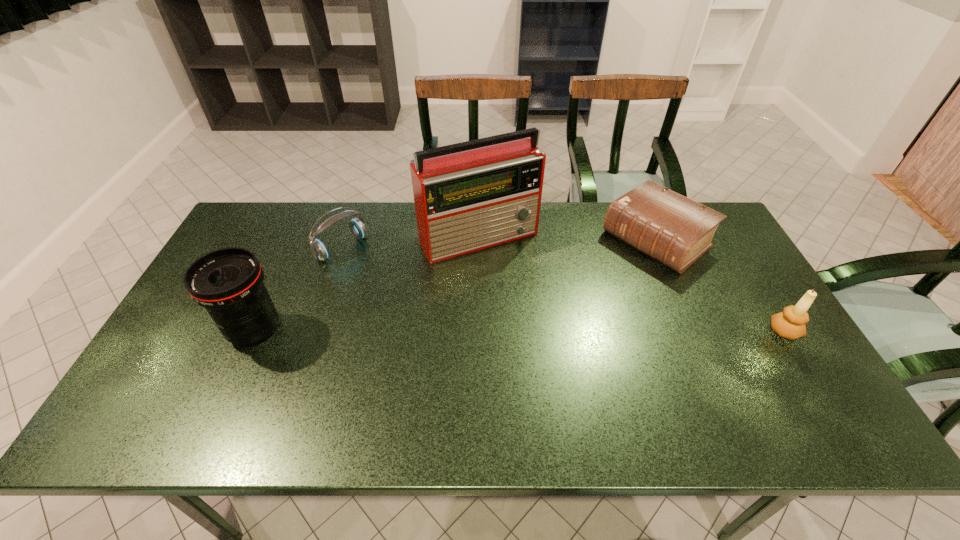
I want to click on vacant point located between the fourth object from left to right and the radio receiver, so click(x=567, y=238).

Locate an element on the screen. free space between the telephoto lens and the rightmost object is located at coordinates (519, 330).

Identify the location of vacant area that lies between the candle_holder and the headset. (563, 289).

Where is `vacant space in between the candle_holder and the radio receiver`? vacant space in between the candle_holder and the radio receiver is located at coordinates (632, 284).

Where is `vacant point located between the fourth shortest object and the rightmost object`? vacant point located between the fourth shortest object and the rightmost object is located at coordinates (519, 330).

Where is `vacant space that is in between the fourth object from left to right and the radio receiver`? vacant space that is in between the fourth object from left to right and the radio receiver is located at coordinates (567, 238).

What are the coordinates of `vacant area that lies between the tallest object and the fourth object from left to right` in the screenshot? It's located at (567, 238).

This screenshot has height=540, width=960. What are the coordinates of `vacant region between the Bible and the second tallest object` in the screenshot? It's located at (456, 285).

Locate an element on the screen. The width and height of the screenshot is (960, 540). object that stands as the second closest to the tallest object is located at coordinates (676, 231).

Locate which object ranks second in proximity to the candle_holder. Please provide its 2D coordinates. Your answer should be formatted as a tuple, i.e. [(x, y)], where the tuple contains the x and y coordinates of a point satisfying the conditions above.

[(468, 196)]